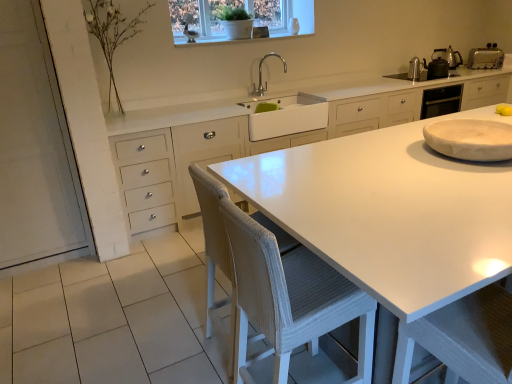
Question: From a real-world perspective, is white marble plate at right, acting as the 1th appliance starting from the bottom, over silver metallic toaster at upper right, which ranks as the first appliance in right-to-left order?

Choices:
 (A) yes
 (B) no

Answer: (B)

Question: From the image's perspective, is white marble plate at right, the fourth appliance positioned from the back, above silver metallic toaster at upper right, acting as the 4th appliance starting from the left?

Choices:
 (A) yes
 (B) no

Answer: (B)

Question: Does white marble plate at right, the fourth appliance in the right-to-left sequence, have a greater width compared to silver metallic toaster at upper right, which ranks as the first appliance in right-to-left order?

Choices:
 (A) no
 (B) yes

Answer: (B)

Question: Considering the relative sizes of white marble plate at right, positioned as the 1th appliance in left-to-right order, and silver metallic toaster at upper right, the third appliance positioned from the bottom, in the image provided, is white marble plate at right, positioned as the 1th appliance in left-to-right order, thinner than silver metallic toaster at upper right, the third appliance positioned from the bottom,?

Choices:
 (A) no
 (B) yes

Answer: (A)

Question: Is white marble plate at right, acting as the 1th appliance starting from the bottom, with silver metallic toaster at upper right, the 2th appliance when ordered from back to front?

Choices:
 (A) no
 (B) yes

Answer: (A)

Question: Can you confirm if white marble plate at right, placed as the 1th appliance when sorted from front to back, is positioned to the right of silver metallic toaster at upper right, which is the second appliance from top to bottom?

Choices:
 (A) yes
 (B) no

Answer: (B)

Question: Is silver metallic toaster at upper right, acting as the 4th appliance starting from the left, closer to camera compared to white glossy window at upper center?

Choices:
 (A) yes
 (B) no

Answer: (B)

Question: Does silver metallic toaster at upper right, which ranks as the first appliance in right-to-left order, appear on the right side of white glossy window at upper center?

Choices:
 (A) no
 (B) yes

Answer: (B)

Question: Considering the relative positions of silver metallic toaster at upper right, the third appliance positioned from the bottom, and white glossy window at upper center in the image provided, is silver metallic toaster at upper right, the third appliance positioned from the bottom, to the left of white glossy window at upper center from the viewer's perspective?

Choices:
 (A) no
 (B) yes

Answer: (A)

Question: Considering the relative sizes of silver metallic toaster at upper right, which is the second appliance from top to bottom, and white glossy window at upper center in the image provided, is silver metallic toaster at upper right, which is the second appliance from top to bottom, smaller than white glossy window at upper center?

Choices:
 (A) yes
 (B) no

Answer: (A)

Question: Is silver metallic toaster at upper right, the third appliance positioned from the bottom, not close to white glossy window at upper center?

Choices:
 (A) yes
 (B) no

Answer: (A)

Question: From the image's perspective, is silver metallic toaster at upper right, acting as the 4th appliance starting from the left, on top of white glossy window at upper center?

Choices:
 (A) yes
 (B) no

Answer: (B)

Question: Could you tell me if silver metallic faucet at upper center is facing white marble plate at right, acting as the 1th appliance starting from the bottom?

Choices:
 (A) no
 (B) yes

Answer: (B)